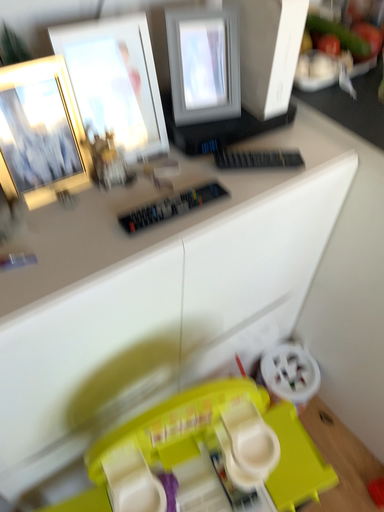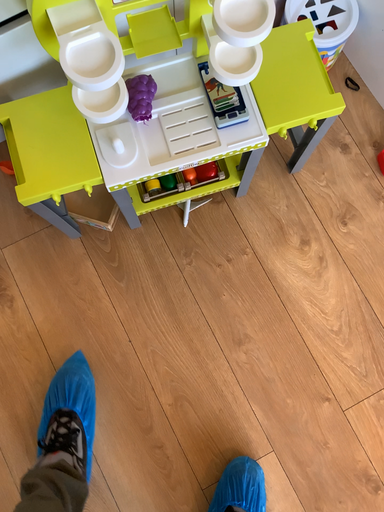
Question: Which way did the camera rotate in the video?

Choices:
 (A) rotated downward
 (B) rotated upward

Answer: (A)